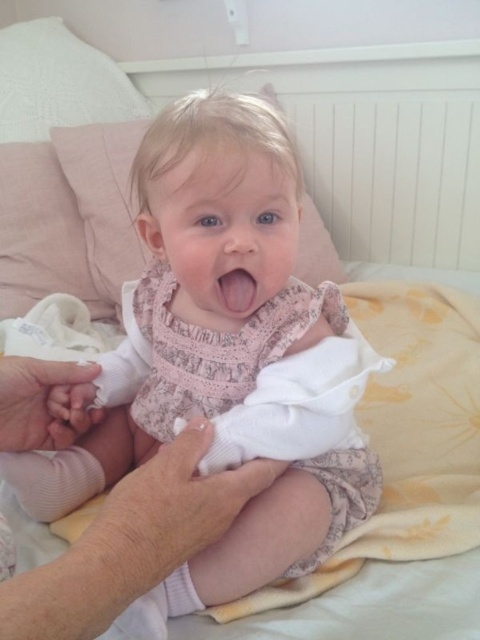
Can you confirm if white cotton diaper at center is positioned above pink glossy lips at center?

A: No, white cotton diaper at center is not above pink glossy lips at center.

Image resolution: width=480 pixels, height=640 pixels. In order to click on white cotton diaper at center in this screenshot , I will do `click(298, 403)`.

You are a GUI agent. You are given a task and a screenshot of the screen. Output one action in this format:
    pyautogui.click(x=<x>, y=<y>)
    Task: Click on the white cotton diaper at center
    The image size is (480, 640).
    Given the screenshot: What is the action you would take?
    pyautogui.click(x=298, y=403)

Is point (338, 536) closer to camera compared to point (347, 404)?

No, (338, 536) is further to viewer.

This screenshot has width=480, height=640. What do you see at coordinates (224, 356) in the screenshot?
I see `pink fabric baby at center` at bounding box center [224, 356].

Between point (216, 448) and point (302, 337), which one is positioned in front?

Point (216, 448) is in front.

Locate an element on the screen. pink fabric baby at center is located at coordinates (224, 356).

Which of these two, pink fabric baby at center or pink glossy lips at center, stands shorter?

pink glossy lips at center

Does pink fabric baby at center come behind pink glossy lips at center?

No, pink fabric baby at center is closer to the viewer.

Measure the distance between point (316, 506) and camera.

Point (316, 506) is 22.20 inches from camera.

Find the location of `pink fabric baby at center`. pink fabric baby at center is located at coordinates (224, 356).